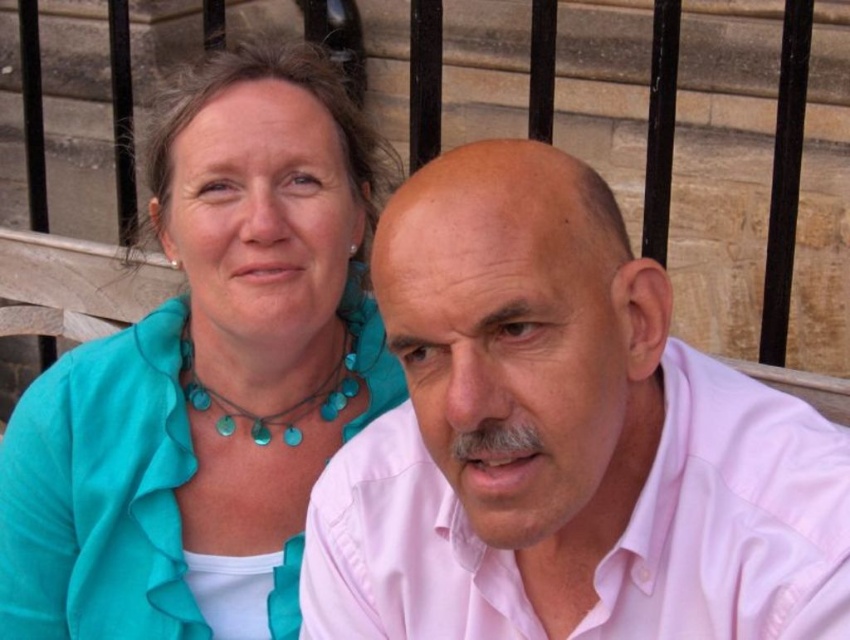
Looking at this image, you are a photographer setting up for a portrait. You need to ensure that the two subjects, the pink cotton shirt at center and the teal fabric blouse at upper left, are positioned at least 1 meter apart for proper framing. Based on the scene, can you confirm if they meet this requirement?

The distance between the pink cotton shirt at center and the teal fabric blouse at upper left is 85.50 centimeters, which is less than 1 meter. Therefore, they are not positioned far enough apart for the required framing.

What is the color of the fabric at point (208,376)?

The teal fabric blouse at upper left is located at point (208,376), so the color is teal.